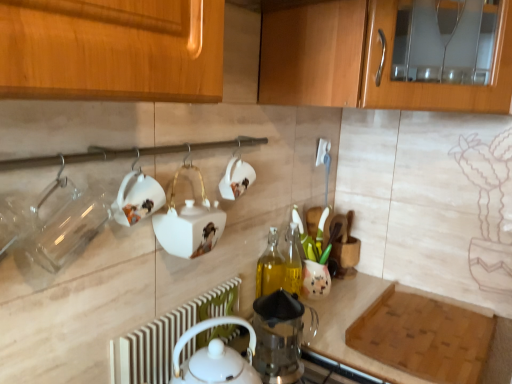
Question: Can you confirm if transparent glass jar at left, the 3th tableware when ordered from back to front, is thinner than wooden cabinet at upper right?

Choices:
 (A) no
 (B) yes

Answer: (B)

Question: Is transparent glass jar at left, the 3th tableware positioned from the right, to the left of wooden cabinet at upper right from the viewer's perspective?

Choices:
 (A) no
 (B) yes

Answer: (B)

Question: Is transparent glass jar at left, arranged as the 1th tableware when viewed from the front, smaller than wooden cabinet at upper right?

Choices:
 (A) yes
 (B) no

Answer: (A)

Question: Is transparent glass jar at left, arranged as the 1th tableware when viewed from the front, not inside wooden cabinet at upper right?

Choices:
 (A) yes
 (B) no

Answer: (A)

Question: From a real-world perspective, does transparent glass jar at left, the 3th tableware when ordered from back to front, sit lower than wooden cabinet at upper right?

Choices:
 (A) no
 (B) yes

Answer: (B)

Question: In terms of height, does white glossy teapot at upper center, arranged as the 2th tableware when viewed from the front, look taller or shorter compared to white glossy teapot at center, positioned as the second appliance in bottom-to-top order?

Choices:
 (A) short
 (B) tall

Answer: (A)

Question: Which is correct: white glossy teapot at upper center, the 2th tableware positioned from the right, is inside white glossy teapot at center, the first appliance in the left-to-right sequence, or outside of it?

Choices:
 (A) inside
 (B) outside

Answer: (B)

Question: In the image, is white glossy teapot at upper center, marked as the second tableware in a left-to-right arrangement, on the left side or the right side of white glossy teapot at center, the 1th appliance viewed from the top?

Choices:
 (A) left
 (B) right

Answer: (A)

Question: Is point (147, 200) closer or farther from the camera than point (200, 244)?

Choices:
 (A) farther
 (B) closer

Answer: (B)

Question: Considering the positions of white glossy teapot at center, the 1th appliance viewed from the top, and transparent glass coffee press at center, which is the first appliance in right-to-left order, in the image, is white glossy teapot at center, the 1th appliance viewed from the top, bigger or smaller than transparent glass coffee press at center, which is the first appliance in right-to-left order,?

Choices:
 (A) big
 (B) small

Answer: (B)

Question: Considering the relative positions of white glossy teapot at center, marked as the 2th appliance in a right-to-left arrangement, and transparent glass coffee press at center, the 1th appliance in the bottom-to-top sequence, in the image provided, is white glossy teapot at center, marked as the 2th appliance in a right-to-left arrangement, to the left or to the right of transparent glass coffee press at center, the 1th appliance in the bottom-to-top sequence,?

Choices:
 (A) left
 (B) right

Answer: (A)

Question: Choose the correct answer: Is white glossy teapot at center, marked as the 2th appliance in a right-to-left arrangement, inside transparent glass coffee press at center, the second appliance viewed from the left, or outside it?

Choices:
 (A) inside
 (B) outside

Answer: (B)

Question: Looking at their shapes, would you say white glossy teapot at center, the first appliance in the left-to-right sequence, is wider or thinner than transparent glass coffee press at center, placed as the 2th appliance when sorted from top to bottom?

Choices:
 (A) thin
 (B) wide

Answer: (A)

Question: Which is correct: white glossy teapot at center, the 1th appliance viewed from the top, is inside white radiator at lower center, or outside of it?

Choices:
 (A) inside
 (B) outside

Answer: (B)

Question: From a real-world perspective, is white glossy teapot at center, marked as the 2th appliance in a right-to-left arrangement, positioned above or below white radiator at lower center?

Choices:
 (A) above
 (B) below

Answer: (A)